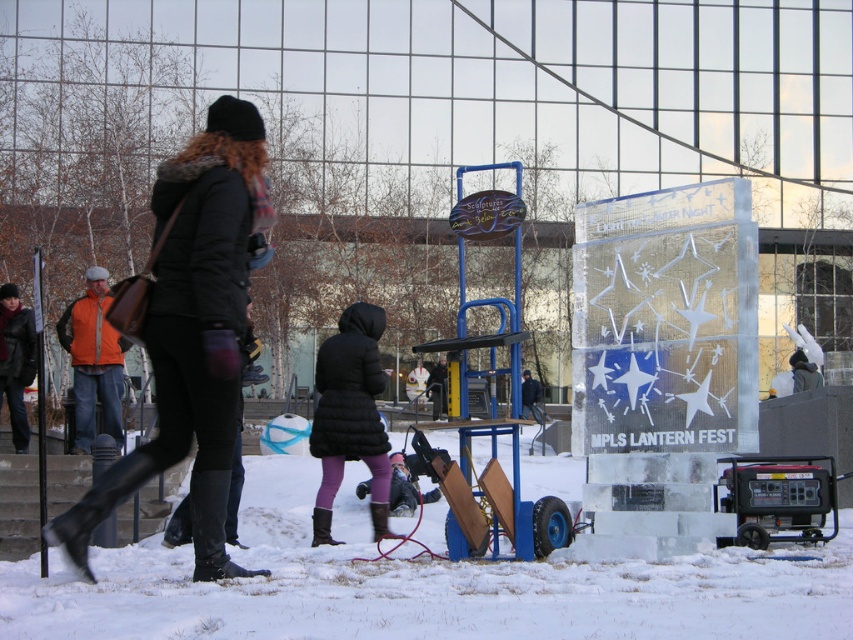
Based on the photo, is orange fleece vest at left shorter than dark blue jacket at center?

Incorrect, orange fleece vest at left's height does not fall short of dark blue jacket at center's.

In order to click on orange fleece vest at left in this screenshot , I will do `click(93, 360)`.

Can you confirm if black leather jacket at upper left is positioned above leather jacket at left?

Yes.

At what (x,y) coordinates should I click in order to perform the action: click on black leather jacket at upper left. Please return your answer as a coordinate pair (x, y). This screenshot has width=853, height=640. Looking at the image, I should click on (190, 333).

Who is more forward, (167,211) or (30,348)?

Positioned in front is point (167,211).

You are a GUI agent. You are given a task and a screenshot of the screen. Output one action in this format:
    pyautogui.click(x=<x>, y=<y>)
    Task: Click on the black leather jacket at upper left
    This screenshot has height=640, width=853.
    Given the screenshot: What is the action you would take?
    190,333

Looking at this image, can you confirm if black leather jacket at upper left is taller than black puffy coat at center?

Yes, black leather jacket at upper left is taller than black puffy coat at center.

Does black leather jacket at upper left have a lesser height compared to black puffy coat at center?

In fact, black leather jacket at upper left may be taller than black puffy coat at center.

Who is more distant from viewer, (207, 561) or (338, 474)?

Point (338, 474)

I want to click on black leather jacket at upper left, so click(x=190, y=333).